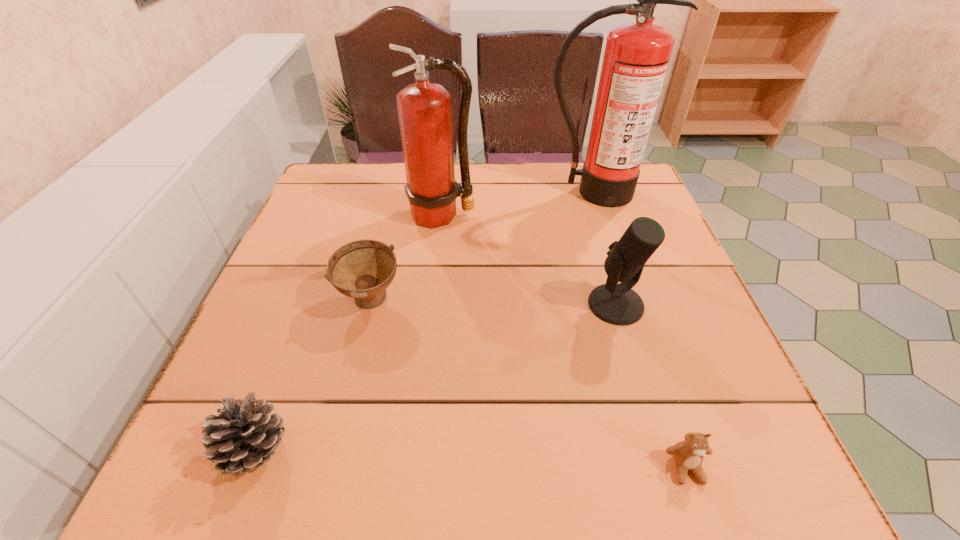
This screenshot has width=960, height=540. I want to click on vacant area between the leftmost object and the tallest object, so click(x=424, y=321).

Where is `vacant space that's between the tallest object and the pinecone`? This screenshot has width=960, height=540. vacant space that's between the tallest object and the pinecone is located at coordinates (424, 321).

This screenshot has height=540, width=960. In order to click on blank region between the taller fire extinguisher and the fourth shortest object in this screenshot , I will do `click(604, 248)`.

At what (x,y) coordinates should I click in order to perform the action: click on empty space that is in between the third tallest object and the pinecone. Please return your answer as a coordinate pair (x, y). Looking at the image, I should click on (436, 377).

At what (x,y) coordinates should I click in order to perform the action: click on unoccupied position between the third tallest object and the taller fire extinguisher. Please return your answer as a coordinate pair (x, y). Looking at the image, I should click on (604, 248).

The image size is (960, 540). Find the location of `free space between the pinecone and the soup bowl`. free space between the pinecone and the soup bowl is located at coordinates (313, 376).

The width and height of the screenshot is (960, 540). In order to click on vacant area that lies between the leftmost object and the tallest object in this screenshot , I will do `click(424, 321)`.

At what (x,y) coordinates should I click in order to perform the action: click on free space between the third tallest object and the teddy bear. Please return your answer as a coordinate pair (x, y). Looking at the image, I should click on (651, 386).

You are a GUI agent. You are given a task and a screenshot of the screen. Output one action in this format:
    pyautogui.click(x=<x>, y=<y>)
    Task: Click on the closest object to the shortest object
    The width and height of the screenshot is (960, 540).
    Given the screenshot: What is the action you would take?
    pyautogui.click(x=617, y=304)

Locate which object is the fourth closest to the microphone. Please provide its 2D coordinates. Your answer should be formatted as a tuple, i.e. [(x, y)], where the tuple contains the x and y coordinates of a point satisfying the conditions above.

[(363, 269)]